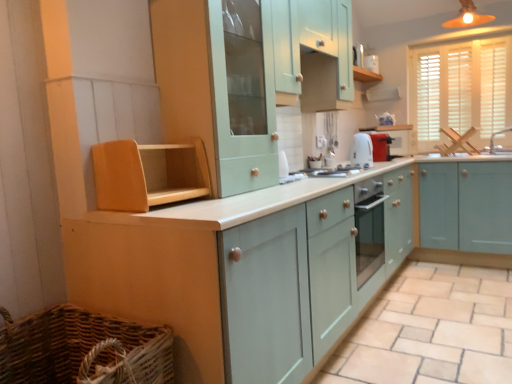
Question: Is matte orange light fixture at upper right looking in the opposite direction of matte teal cabinet at center, the second cabinetry viewed from the right?

Choices:
 (A) no
 (B) yes

Answer: (A)

Question: Is matte orange light fixture at upper right smaller than matte teal cabinet at center, the second cabinetry viewed from the right?

Choices:
 (A) yes
 (B) no

Answer: (A)

Question: Is matte orange light fixture at upper right wider than matte teal cabinet at center, arranged as the fourth cabinetry when viewed from the left?

Choices:
 (A) yes
 (B) no

Answer: (B)

Question: Does matte orange light fixture at upper right have a lesser height compared to matte teal cabinet at center, the second cabinetry viewed from the right?

Choices:
 (A) no
 (B) yes

Answer: (B)

Question: Is matte orange light fixture at upper right thinner than matte teal cabinet at center, the second cabinetry viewed from the right?

Choices:
 (A) no
 (B) yes

Answer: (B)

Question: Is matte orange light fixture at upper right to the left of matte teal cabinet at center, arranged as the fourth cabinetry when viewed from the left, from the viewer's perspective?

Choices:
 (A) yes
 (B) no

Answer: (B)

Question: Is matte white toaster at center, which appears as the 2th appliance when viewed from the back, in contact with matte orange light fixture at upper right?

Choices:
 (A) no
 (B) yes

Answer: (A)

Question: Is matte orange light fixture at upper right surrounded by matte white toaster at center, which appears as the 2th appliance when viewed from the back?

Choices:
 (A) no
 (B) yes

Answer: (A)

Question: Is matte orange light fixture at upper right at the back of matte white toaster at center, which appears as the 2th appliance when viewed from the back?

Choices:
 (A) no
 (B) yes

Answer: (A)

Question: Can you confirm if matte white toaster at center, marked as the 2th appliance in a front-to-back arrangement, is shorter than matte orange light fixture at upper right?

Choices:
 (A) yes
 (B) no

Answer: (A)

Question: Is matte white toaster at center, which appears as the 2th appliance when viewed from the back, positioned before matte orange light fixture at upper right?

Choices:
 (A) no
 (B) yes

Answer: (A)

Question: From a real-world perspective, is matte white toaster at center, which appears as the 2th appliance when viewed from the back, on top of matte orange light fixture at upper right?

Choices:
 (A) yes
 (B) no

Answer: (B)

Question: Is woven brown basket at lower left positioned with its back to white glossy exhaust hood at upper center?

Choices:
 (A) no
 (B) yes

Answer: (A)